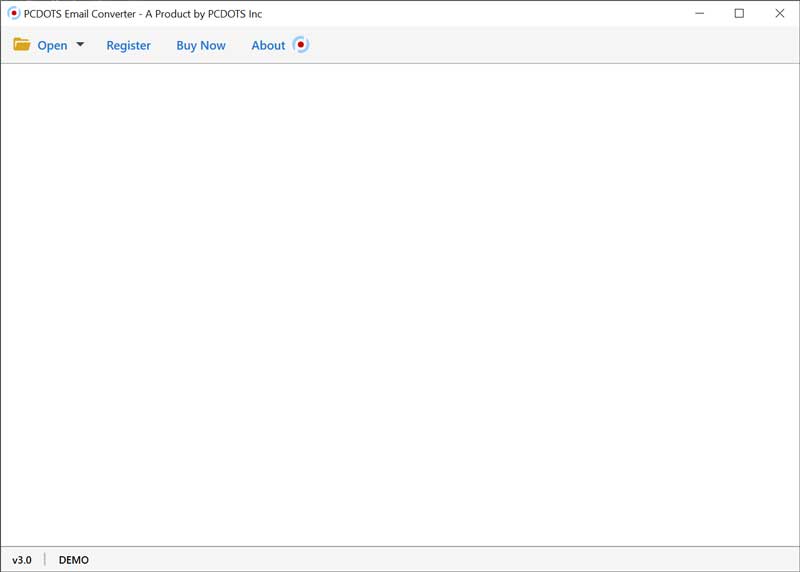
The width and height of the screenshot is (800, 572). I want to click on register, so click(125, 47).